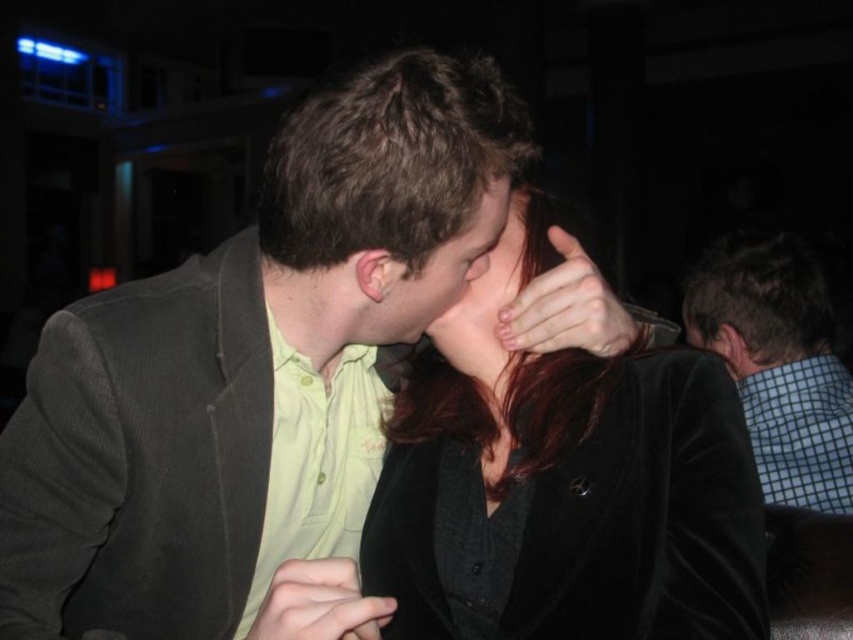
You are a photographer adjusting your camera settings to capture the scene between the velvet black jacket at center and the matte yellow shirt at center. Which object should you focus on first if you want to ensure both are in sharp focus?

The velvet black jacket at center is located above the matte yellow shirt at center. To ensure both are in sharp focus, you should focus on the matte yellow shirt at center first, as it is closer to the camera, and the velvet black jacket at center will naturally fall into focus due to its position above.

You are a photographer adjusting the lighting in the scene. You need to ensure both the matte black hand at center and the matte skin nose at center are well lit. Which object requires more careful adjustment to avoid underexposure?

The matte black hand at center requires more careful adjustment to avoid underexposure because darker objects often need more light to achieve proper exposure compared to lighter ones like the matte skin nose at center.

What is the color of the object at point (560, 301)?

The object at point (560, 301) is matte black.